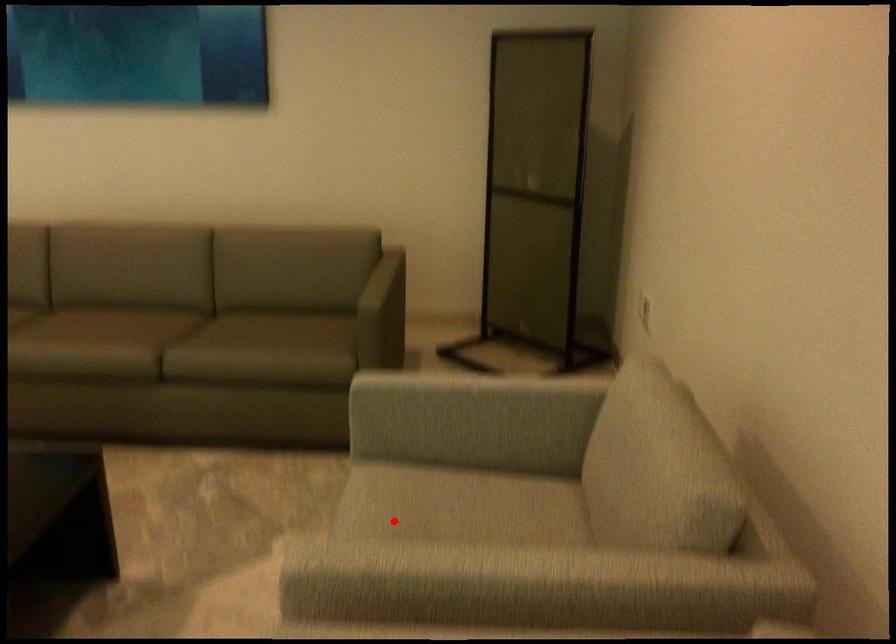
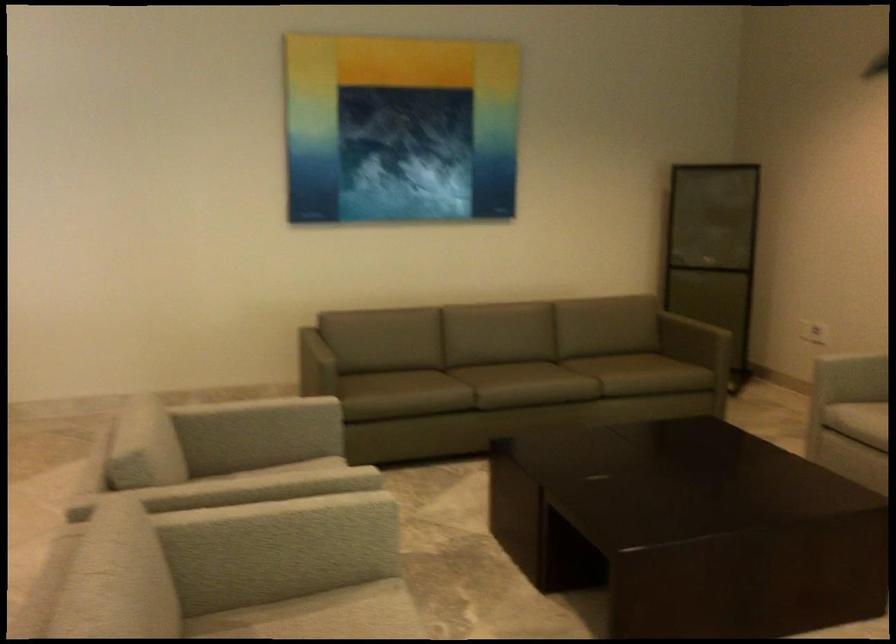
Question: I am providing you with two images of the same scene from different viewpoints. A red point is shown in image1. For the corresponding object point in image2, is it positioned nearer or farther from the camera?

Choices:
 (A) Nearer
 (B) Farther

Answer: (B)